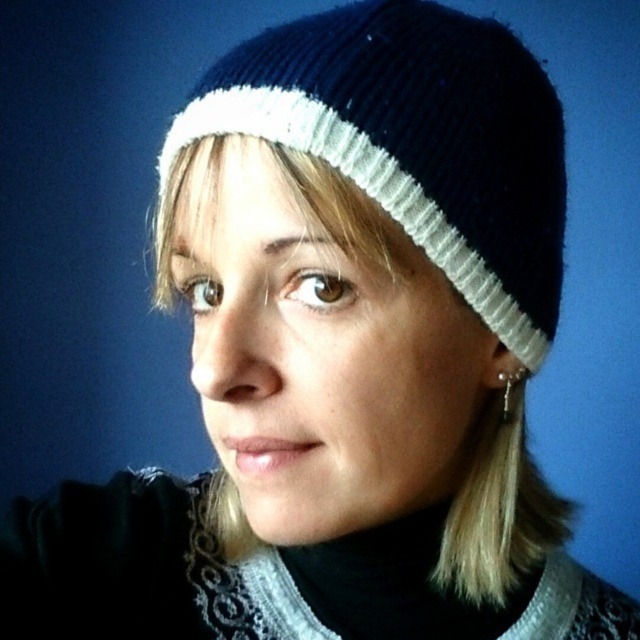
Is point (248, 92) closer to viewer compared to point (516, 368)?

Yes, it is in front of point (516, 368).

Who is more distant from viewer, (x=392, y=13) or (x=502, y=412)?

The point (x=502, y=412) is behind.

Who is more forward, (444, 252) or (524, 369)?

Point (444, 252) is in front.

This screenshot has width=640, height=640. I want to click on navy blue knitted hat at center, so click(x=413, y=141).